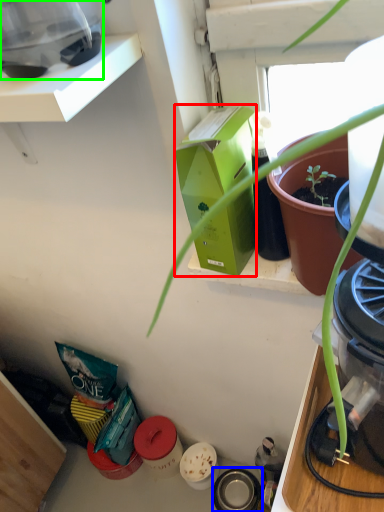
Question: Which is farther away from box (highlighted by a red box)? appliance (highlighted by a blue box) or appliance (highlighted by a green box)?

Choices:
 (A) appliance
 (B) appliance

Answer: (A)